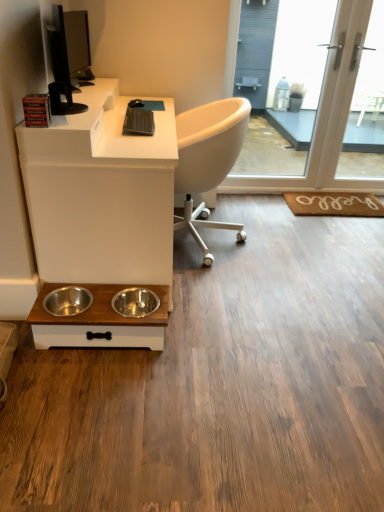
What are the coordinates of `free location in front of stainless steel bowls at lower center` in the screenshot? It's located at [x=96, y=395].